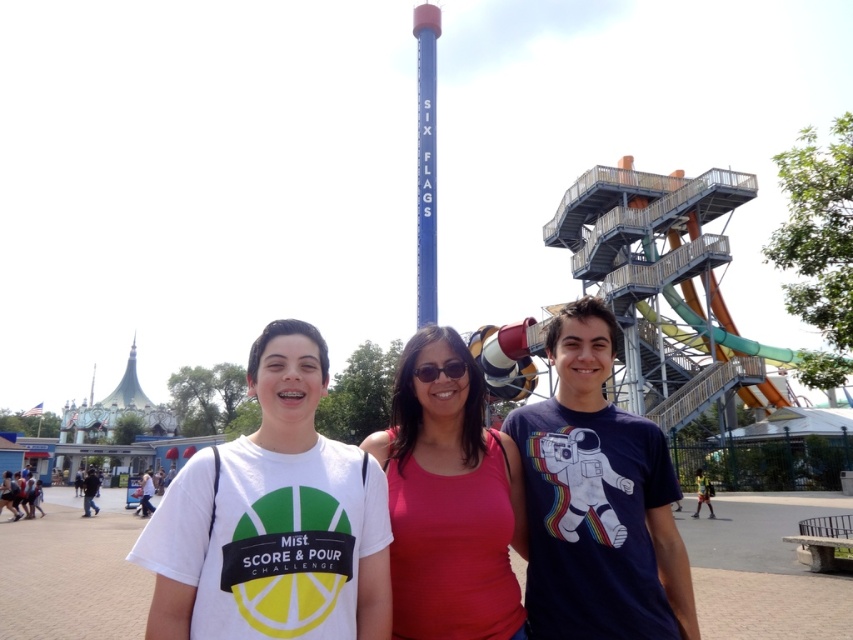
You are a photographer at Six Flags amusement park. You notice the red matte tank top at center and the blue metallic pole at center in your shot. Which object is closer to the camera?

The red matte tank top at center is closer to the camera because it is in front of the blue metallic pole at center.

You are a photographer at Six Flags amusement park. You need to capture a photo of the red matte tank top at center and the black plastic sunglasses at center. Which object is positioned to the right of the other?

The red matte tank top at center is to the right of the black plastic sunglasses at center.